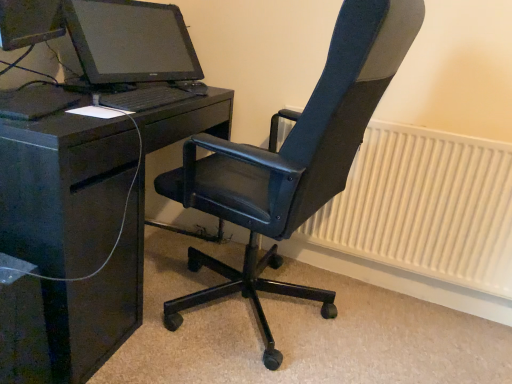
The height and width of the screenshot is (384, 512). I want to click on free space above black matte keyboard at center (from a real-world perspective), so click(x=144, y=91).